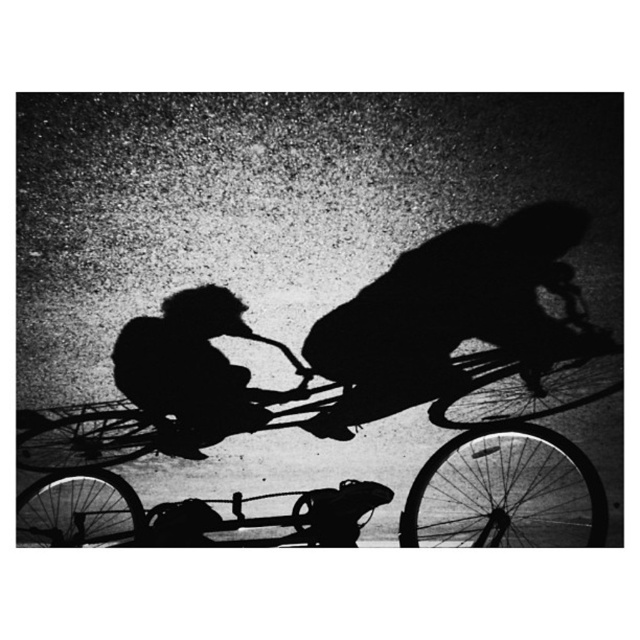
Does black matte bicycle rider at center appear under silhouette cyclist at center?

No, black matte bicycle rider at center is not below silhouette cyclist at center.

Can you confirm if black matte bicycle rider at center is positioned to the right of silhouette cyclist at center?

Yes, black matte bicycle rider at center is to the right of silhouette cyclist at center.

Who is more forward, (419, 307) or (120, 392)?

Point (419, 307) is in front.

Identify the location of black matte bicycle rider at center. (449, 316).